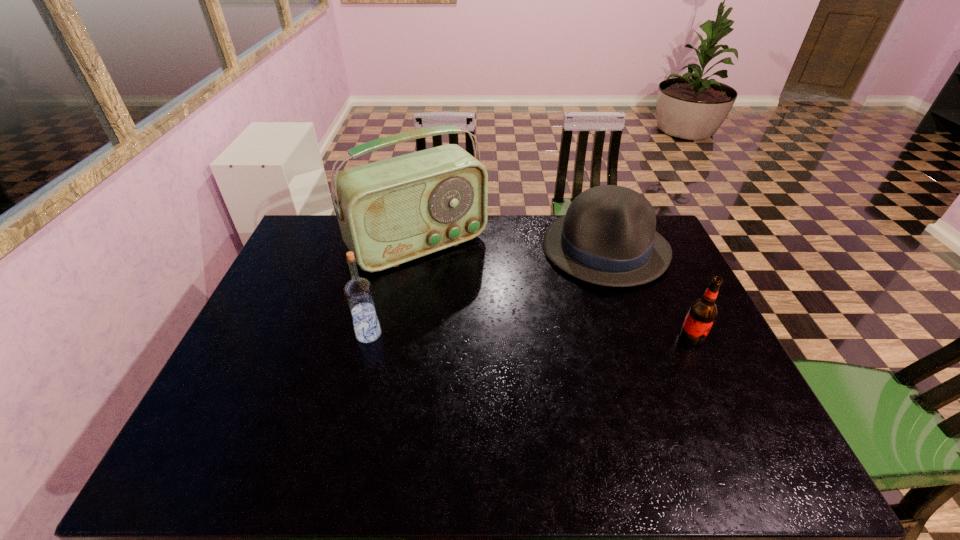
The height and width of the screenshot is (540, 960). Find the location of `vodka`. vodka is located at coordinates (358, 291).

Identify the location of root beer. This screenshot has width=960, height=540. (702, 313).

Locate an element on the screen. bowler hat is located at coordinates (607, 237).

Image resolution: width=960 pixels, height=540 pixels. I want to click on the tallest object, so click(392, 211).

At what (x,y) coordinates should I click in order to perform the action: click on vacant space located on the front of the vodka. Please return your answer as a coordinate pair (x, y). This screenshot has width=960, height=540. Looking at the image, I should click on (363, 359).

Locate an element on the screen. The width and height of the screenshot is (960, 540). vacant space located 0.330m on the back of the root beer is located at coordinates (652, 254).

You are a GUI agent. You are given a task and a screenshot of the screen. Output one action in this format:
    pyautogui.click(x=<x>, y=<y>)
    Task: Click on the free spot located 0.070m on the front-facing side of the bowler hat
    This screenshot has width=960, height=540.
    Given the screenshot: What is the action you would take?
    point(587,302)

The image size is (960, 540). Identify the location of vacant space located on the front-facing side of the bowler hat. (582, 315).

Locate an element on the screen. This screenshot has height=540, width=960. vacant space located on the front-facing side of the bowler hat is located at coordinates (574, 338).

Where is `free spot located 0.300m on the front panel of the tallest object`? The height and width of the screenshot is (540, 960). free spot located 0.300m on the front panel of the tallest object is located at coordinates (504, 338).